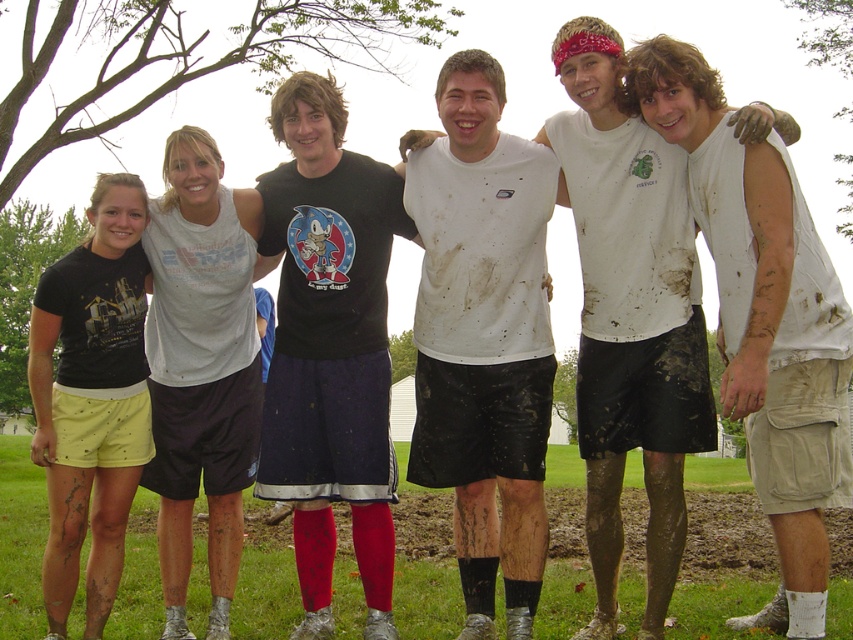
Question: Can you confirm if black t-shirt at center is positioned below white matte shirt at center?

Choices:
 (A) no
 (B) yes

Answer: (B)

Question: Can you confirm if white sleeveless shirt at center is positioned to the left of white matte shirt at center?

Choices:
 (A) no
 (B) yes

Answer: (A)

Question: Which object is closer to the camera taking this photo?

Choices:
 (A) white sleeveless shirt at center
 (B) white matte shirt at center
 (C) black t-shirt at center
 (D) white matte tank top at center

Answer: (A)

Question: Estimate the real-world distances between objects in this image. Which object is farther from the white matte tank top at center?

Choices:
 (A) white matte shirt at center
 (B) white sleeveless shirt at center

Answer: (B)

Question: Which is nearer to the black t-shirt at center?

Choices:
 (A) white matte tank top at center
 (B) white matte shirt at center

Answer: (A)

Question: Can you confirm if black t-shirt at center is positioned to the left of white sleeveless shirt at center?

Choices:
 (A) no
 (B) yes

Answer: (B)